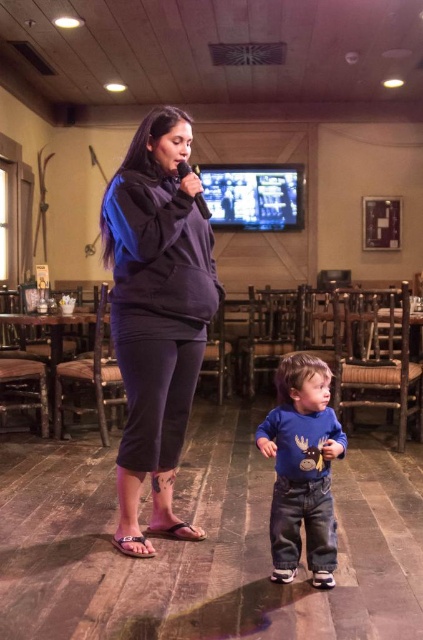
You are a delivery person who needs to place a small package between the dark gray fleece at center and the blue cotton shirt at lower center. Can you fit the package, which is 60 centimeters long, between them?

The distance between the dark gray fleece at center and the blue cotton shirt at lower center is 58.35 centimeters. Since the package is 60 centimeters long, it is longer than the available space, so it cannot be placed between them.

You are a photographer setting up for a live event. You need to position a camera so that both the blue cotton shirt at lower center and the black matte microphone at upper center are in frame. Based on their sizes, which object should you ensure is closer to the camera to maintain clarity?

The blue cotton shirt at lower center might be wider than the black matte microphone at upper center, so to maintain clarity, the blue cotton shirt at lower center should be closer to the camera since larger objects can be positioned nearer to ensure they are in focus without overwhelming the frame.

You are a photographer setting up for a live event. You need to position a camera so it can capture both the dark gray fleece at center and the black matte microphone at upper center clearly. Based on their positions, which object should be placed closer to the left side of the camera frame?

The dark gray fleece at center is to the left of the black matte microphone at upper center, so to capture both clearly, the dark gray fleece at center should be positioned closer to the left side of the camera frame.